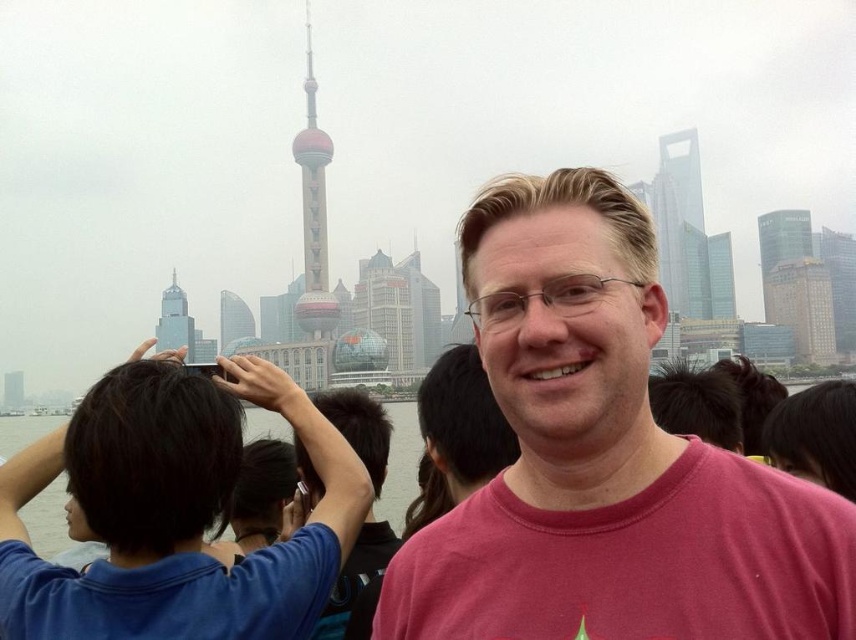
Question: Which point is farther to the camera?

Choices:
 (A) dark blue fabric at left
 (B) shiny glass tower at center
 (C) glassy beige skyscraper at center-right
 (D) shiny glass skyscraper at center

Answer: (D)

Question: Can you confirm if glassy beige skyscraper at center-right is positioned above shiny glass skyscraper at center?

Choices:
 (A) no
 (B) yes

Answer: (B)

Question: Does pink cotton t-shirt at center appear over glassy beige skyscraper at center-right?

Choices:
 (A) yes
 (B) no

Answer: (B)

Question: Is glassy beige skyscraper at center-right smaller than glassy reflective skyscraper at center?

Choices:
 (A) yes
 (B) no

Answer: (A)

Question: Considering the real-world distances, which object is farthest from the glassy beige skyscraper at center-right?

Choices:
 (A) shiny glass tower at center
 (B) shiny glass skyscraper at center

Answer: (B)

Question: Which object is the closest to the glassy reflective skyscraper at upper right?

Choices:
 (A) glassy reflective skyscraper at center
 (B) dark blue fabric at left

Answer: (A)